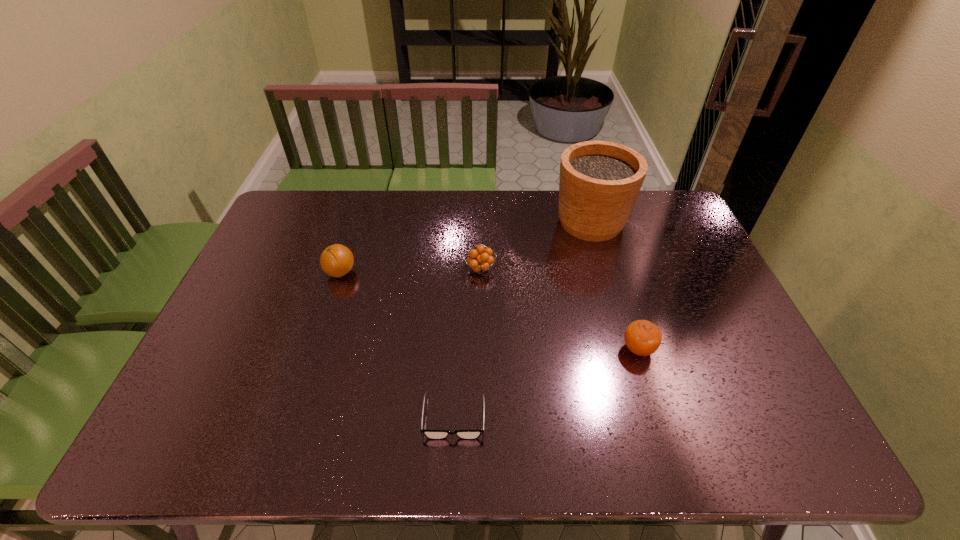
You are a GUI agent. You are given a task and a screenshot of the screen. Output one action in this format:
    pyautogui.click(x=<x>, y=<y>)
    Task: Click on the free space located on the front of the leftmost object
    
    Given the screenshot: What is the action you would take?
    pyautogui.click(x=327, y=314)

Where is `free location located on the right of the fourth farthest object`? The image size is (960, 540). free location located on the right of the fourth farthest object is located at coordinates coord(751,349).

Locate an element on the screen. free space located 0.400m on the front of the shortest orange fruit is located at coordinates (x=480, y=399).

Find the location of a particular element. The width and height of the screenshot is (960, 540). object that is positioned at the far edge is located at coordinates (599, 183).

This screenshot has width=960, height=540. In order to click on object at the near edge in this screenshot , I will do `click(430, 434)`.

This screenshot has height=540, width=960. In the image, there is a desktop. What are the coordinates of `vacant space at the far edge` in the screenshot? It's located at (435, 229).

You are a GUI agent. You are given a task and a screenshot of the screen. Output one action in this format:
    pyautogui.click(x=<x>, y=<y>)
    Task: Click on the free space at the near edge
    The image size is (960, 540).
    Given the screenshot: What is the action you would take?
    pyautogui.click(x=323, y=453)

The height and width of the screenshot is (540, 960). Find the location of `blank space at the left edge of the desktop`. blank space at the left edge of the desktop is located at coordinates (230, 400).

Where is `vacant space at the right edge of the desktop`? The height and width of the screenshot is (540, 960). vacant space at the right edge of the desktop is located at coordinates (678, 298).

Locate an element on the screen. The image size is (960, 540). vacant space at the far left corner of the desktop is located at coordinates (327, 198).